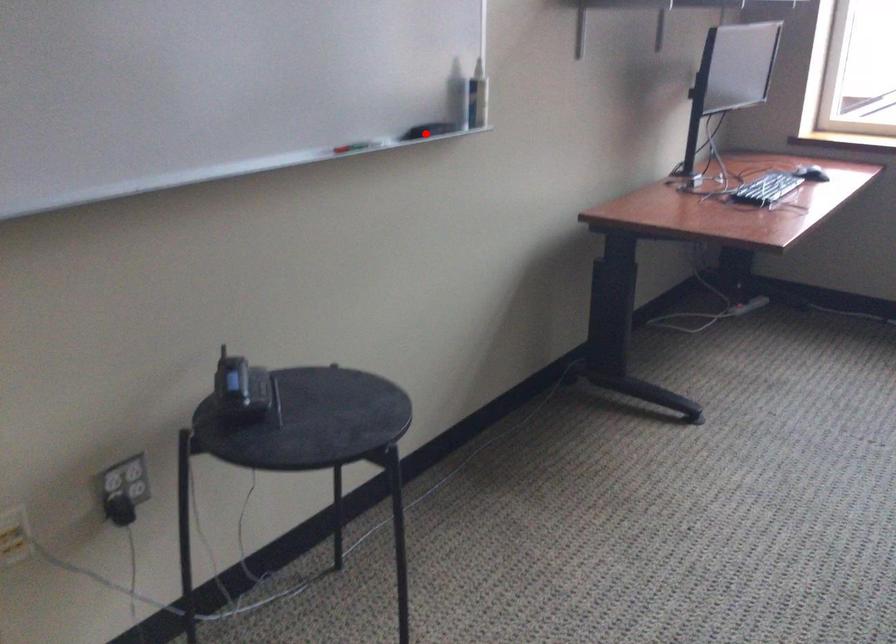
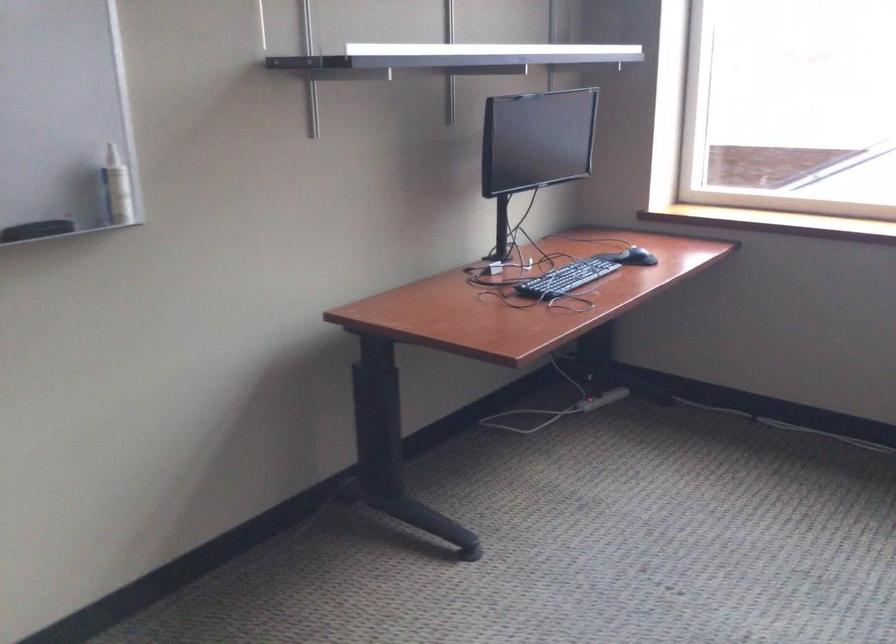
Question: I am providing you with two images of the same scene from different viewpoints. Image1 has a red point marked. In image2, the corresponding 3D location appears at what relative position? Reply with the corresponding letter.

Choices:
 (A) Closer
 (B) Farther

Answer: (A)